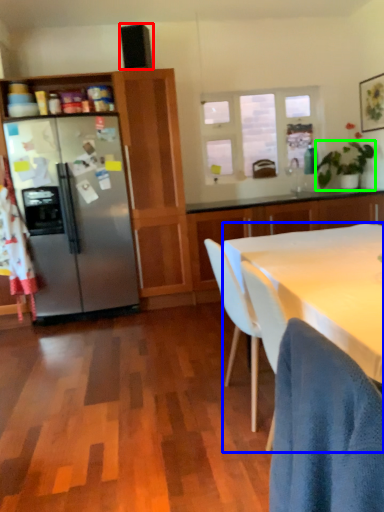
Question: Based on their relative distances, which object is farther from loudspeaker (highlighted by a red box)? Choose from desk (highlighted by a blue box) and houseplant (highlighted by a green box).

Choices:
 (A) desk
 (B) houseplant

Answer: (A)